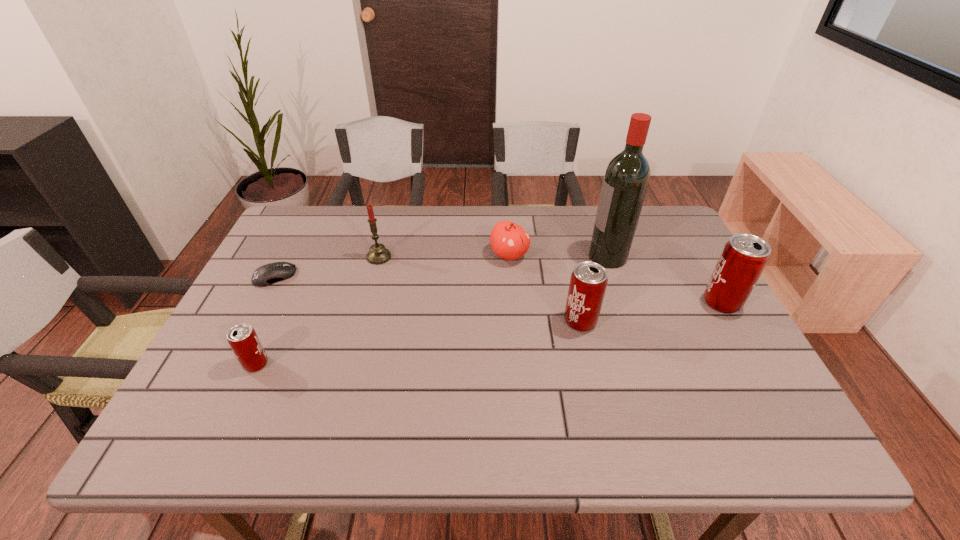
This screenshot has width=960, height=540. In order to click on wine bottle located in the far edge section of the desktop in this screenshot , I will do `click(627, 176)`.

At what (x,y) coordinates should I click in order to perform the action: click on candle that is at the far edge. Please return your answer as a coordinate pair (x, y). Looking at the image, I should click on (378, 254).

You are a GUI agent. You are given a task and a screenshot of the screen. Output one action in this format:
    pyautogui.click(x=<x>, y=<y>)
    Task: Click on the object that is at the near edge
    The image size is (960, 540).
    Given the screenshot: What is the action you would take?
    pyautogui.click(x=242, y=338)

The width and height of the screenshot is (960, 540). I want to click on beer can that is positioned at the left edge, so click(242, 338).

Identify the location of computer equipment present at the left edge. The width and height of the screenshot is (960, 540). (271, 273).

Find the location of a particular element. The height and width of the screenshot is (540, 960). object present at the right edge is located at coordinates (744, 257).

Identify the location of object positioned at the near left corner. (242, 338).

Where is `free space at the far edge`? free space at the far edge is located at coordinates (460, 243).

Image resolution: width=960 pixels, height=540 pixels. I want to click on vacant region at the near edge of the desktop, so click(x=676, y=393).

I want to click on free location at the left edge of the desktop, so click(269, 290).